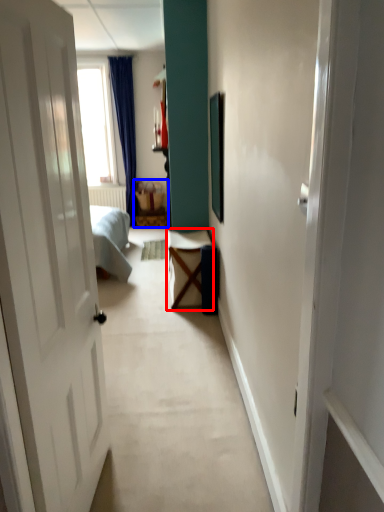
Question: Which object appears farthest to the camera in this image, table (highlighted by a red box) or furniture (highlighted by a blue box)?

Choices:
 (A) table
 (B) furniture

Answer: (B)